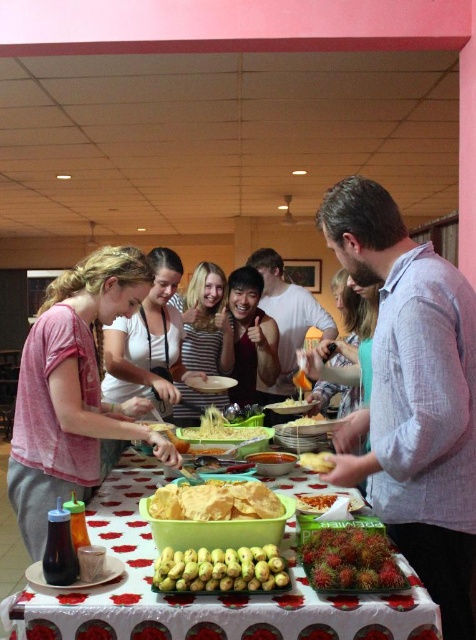
Question: Is green plastic tray at center further to camera compared to smooth yellow rambutan at center?

Choices:
 (A) no
 (B) yes

Answer: (A)

Question: Which point is farther from the camera taking this photo?

Choices:
 (A) (161, 576)
 (B) (321, 416)

Answer: (B)

Question: Which is farther from the green plastic tray at center?

Choices:
 (A) striped cotton shirt at center
 (B) yellow matte plastic bowl at center

Answer: (A)

Question: Considering the relative positions of green plastic tray at center and yellow matte chips at center in the image provided, where is green plastic tray at center located with respect to yellow matte chips at center?

Choices:
 (A) above
 (B) below

Answer: (B)

Question: Is yellow matte bananas at center further to camera compared to yellow matte tortilla at center?

Choices:
 (A) yes
 (B) no

Answer: (B)

Question: Based on their relative distances, which object is nearer to the pink cotton shirt at center?

Choices:
 (A) gray cotton shirt at center
 (B) green plastic tray at center
 (C) yellow matte tortilla at center
 (D) yellow matte chips at center

Answer: (B)